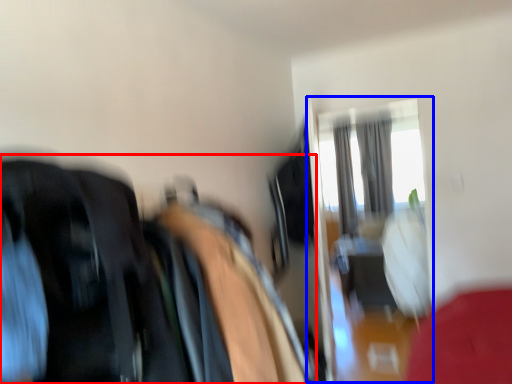
Question: Which object is closer to the camera taking this photo, laundry (highlighted by a red box) or glass door (highlighted by a blue box)?

Choices:
 (A) laundry
 (B) glass door

Answer: (A)